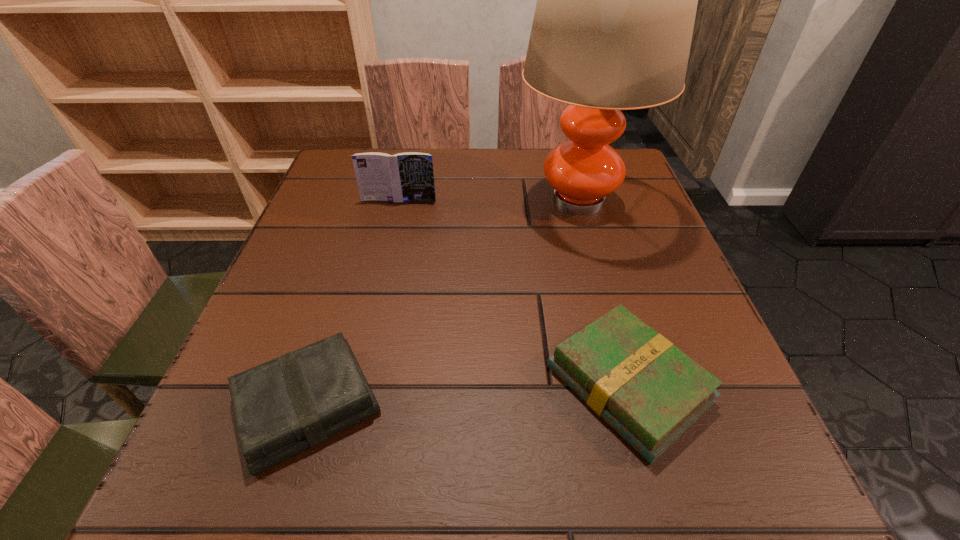
This screenshot has height=540, width=960. In order to click on book that is positioned at the right edge in this screenshot , I will do `click(650, 392)`.

You are a GUI agent. You are given a task and a screenshot of the screen. Output one action in this format:
    pyautogui.click(x=<x>, y=<y>)
    Task: Click on the object at the far left corner
    
    Given the screenshot: What is the action you would take?
    pyautogui.click(x=408, y=176)

You are a GUI agent. You are given a task and a screenshot of the screen. Output one action in this format:
    pyautogui.click(x=<x>, y=<y>)
    Task: Click on the object that is at the near left corner
    The width and height of the screenshot is (960, 540).
    Given the screenshot: What is the action you would take?
    pyautogui.click(x=282, y=407)

The height and width of the screenshot is (540, 960). Find the location of `object that is at the far right corner`. object that is at the far right corner is located at coordinates (616, 3).

You are a GUI agent. You are given a task and a screenshot of the screen. Output one action in this format:
    pyautogui.click(x=<x>, y=<y>)
    Task: Click on the object positioned at the near right corner
    
    Given the screenshot: What is the action you would take?
    pyautogui.click(x=650, y=392)

Where is `blank space at the far edge of the desktop`? blank space at the far edge of the desktop is located at coordinates (442, 178).

Locate an element on the screen. blank space at the left edge is located at coordinates (341, 232).

This screenshot has height=540, width=960. I want to click on vacant space at the right edge of the desktop, so click(712, 359).

Locate an element on the screen. The height and width of the screenshot is (540, 960). vacant space at the far left corner of the desktop is located at coordinates (348, 188).

You are a GUI agent. You are given a task and a screenshot of the screen. Output one action in this format:
    pyautogui.click(x=<x>, y=<y>)
    Task: Click on the free space at the near left corner of the desktop
    Image resolution: width=960 pixels, height=540 pixels.
    Given the screenshot: What is the action you would take?
    pyautogui.click(x=295, y=496)